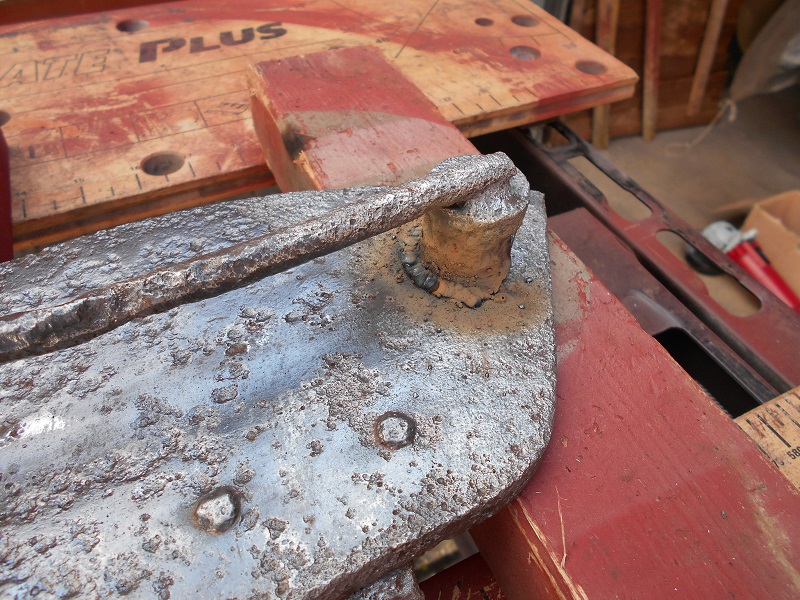
I want to click on box, so click(x=769, y=244).